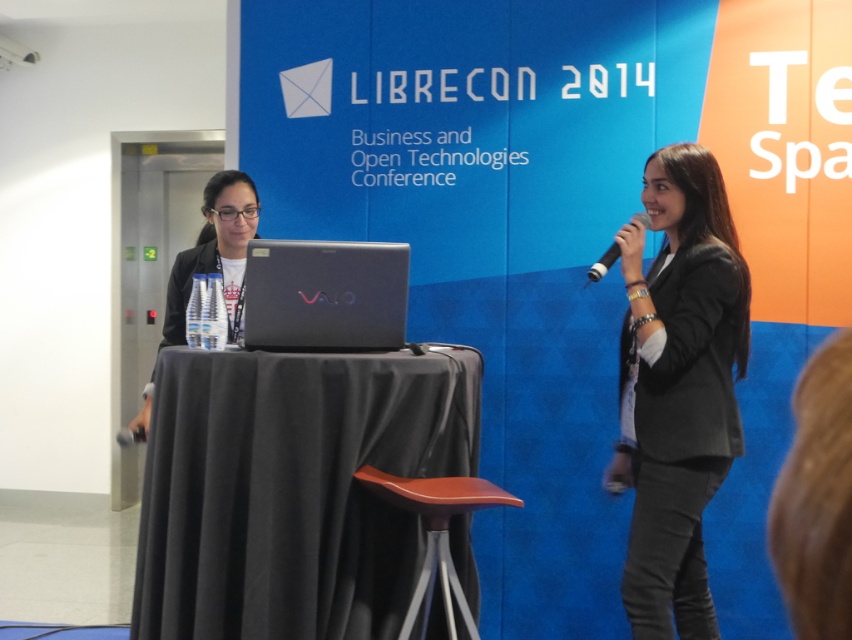
Question: Does satin black laptop at center appear under matte black laptop at center?

Choices:
 (A) yes
 (B) no

Answer: (A)

Question: Which point is farther to the camera?

Choices:
 (A) matte black laptop at center
 (B) dark gray textured blazer at center
 (C) black matte microphone at upper right

Answer: (A)

Question: Which point appears farthest from the camera in this image?

Choices:
 (A) (265, 636)
 (B) (286, 259)
 (C) (602, 257)
 (D) (357, 472)

Answer: (C)

Question: Is satin black laptop at center above brown leather stool at center?

Choices:
 (A) no
 (B) yes

Answer: (B)

Question: Where is black fabric table at center located in relation to satin black laptop at center in the image?

Choices:
 (A) above
 (B) below

Answer: (B)

Question: Which point is farther to the camera?

Choices:
 (A) (285, 304)
 (B) (225, 534)
 (C) (600, 273)

Answer: (C)